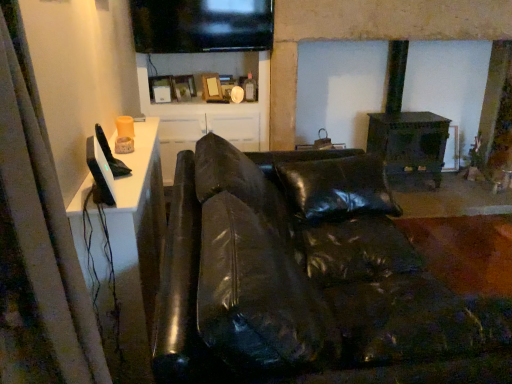
Measure the distance between point (179,72) and camera.

Point (179,72) and camera are 3.42 meters apart from each other.

Locate an element on the screen. This screenshot has height=384, width=512. white glossy cabinet at upper center is located at coordinates (206, 104).

Between black leather couch at center and white fabric curtain at left, which one is positioned in front?

white fabric curtain at left.

Can you confirm if black leather couch at center is thinner than white fabric curtain at left?

Incorrect, the width of black leather couch at center is not less than that of white fabric curtain at left.

Considering the sizes of objects black leather couch at center and white fabric curtain at left in the image provided, who is smaller, black leather couch at center or white fabric curtain at left?

Smaller between the two is white fabric curtain at left.

Which is correct: black leather couch at center is inside white fabric curtain at left, or outside of it?

black leather couch at center is not inside white fabric curtain at left, it's outside.

Is white fabric curtain at left directly adjacent to white glossy cabinet at upper center?

No, white fabric curtain at left is not touching white glossy cabinet at upper center.

Is white fabric curtain at left inside or outside of white glossy cabinet at upper center?

white fabric curtain at left cannot be found inside white glossy cabinet at upper center.

Which object is thinner, white fabric curtain at left or white glossy cabinet at upper center?

white fabric curtain at left is thinner.

Considering the sizes of white fabric curtain at left and white glossy cabinet at upper center in the image, is white fabric curtain at left taller or shorter than white glossy cabinet at upper center?

In the image, white fabric curtain at left appears to be shorter than white glossy cabinet at upper center.

Who is smaller, white glossy cabinet at upper center or white fabric curtain at left?

white fabric curtain at left.

In terms of height, does white glossy cabinet at upper center look taller or shorter compared to white fabric curtain at left?

Considering their sizes, white glossy cabinet at upper center has more height than white fabric curtain at left.

From a real-world perspective, which object stands above the other?

white fabric curtain at left.

From the image's perspective, which is below, white glossy cabinet at upper center or white fabric curtain at left?

white fabric curtain at left appears lower in the image.

Which is more to the right, white fabric curtain at left or black leather couch at center?

black leather couch at center.

Is white fabric curtain at left spatially inside black leather couch at center, or outside of it?

white fabric curtain at left is outside black leather couch at center.

Is white fabric curtain at left aimed at black leather couch at center?

No.

Considering the points (29, 294) and (193, 158), which point is behind, point (29, 294) or point (193, 158)?

The point (193, 158) is farther.

Is black leather couch at center positioned before white glossy cabinet at upper center?

Yes, black leather couch at center is closer to the viewer.

Is black leather couch at center oriented away from white glossy cabinet at upper center?

That's not correct — black leather couch at center is not looking away from white glossy cabinet at upper center.

From a real-world perspective, between black leather couch at center and white glossy cabinet at upper center, who is vertically lower?

From a 3D spatial view, black leather couch at center is below.

Considering the sizes of black leather couch at center and white glossy cabinet at upper center in the image, is black leather couch at center wider or thinner than white glossy cabinet at upper center?

In the image, black leather couch at center appears to be wider than white glossy cabinet at upper center.

From a real-world perspective, is white glossy cabinet at upper center positioned above or below black leather couch at center?

In terms of real-world spatial position, white glossy cabinet at upper center is above black leather couch at center.

Which point is more distant from viewer, (225,118) or (184,273)?

The point (225,118) is farther.

From the image's perspective, is white glossy cabinet at upper center below black leather couch at center?

Actually, white glossy cabinet at upper center appears above black leather couch at center in the image.

Is white glossy cabinet at upper center surrounding black leather couch at center?

That's incorrect, black leather couch at center is not inside white glossy cabinet at upper center.

Identify the location of curtain located in front of the black leather couch at center. The image size is (512, 384). (38, 250).

Where is `curtain below the white glossy cabinet at upper center (from the image's perspective)`? The image size is (512, 384). curtain below the white glossy cabinet at upper center (from the image's perspective) is located at coordinates (38, 250).

From the image, which object appears to be nearer to white fabric curtain at left, black leather couch at center or white glossy cabinet at upper center?

black leather couch at center.

Based on their spatial positions, is white glossy cabinet at upper center or black leather couch at center further from white fabric curtain at left?

white glossy cabinet at upper center is further to white fabric curtain at left.

Which object lies nearer to the anchor point black leather couch at center, white fabric curtain at left or white glossy cabinet at upper center?

Among the two, white fabric curtain at left is located nearer to black leather couch at center.

Looking at this image, which object lies further to the anchor point white glossy cabinet at upper center, white fabric curtain at left or black leather couch at center?

Based on the image, white fabric curtain at left appears to be further to white glossy cabinet at upper center.

When comparing their distances from black leather couch at center, does white glossy cabinet at upper center or white fabric curtain at left seem further?

Based on the image, white glossy cabinet at upper center appears to be further to black leather couch at center.

Which object lies nearer to the anchor point white glossy cabinet at upper center, black leather couch at center or white fabric curtain at left?

Among the two, black leather couch at center is located nearer to white glossy cabinet at upper center.

Identify the location of studio couch between white fabric curtain at left and white glossy cabinet at upper center from front to back. (308, 280).